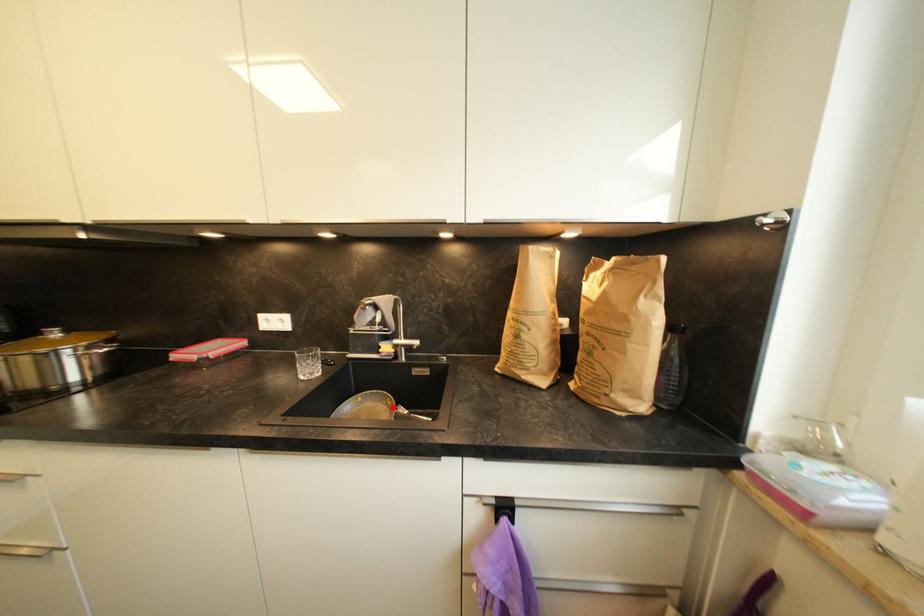
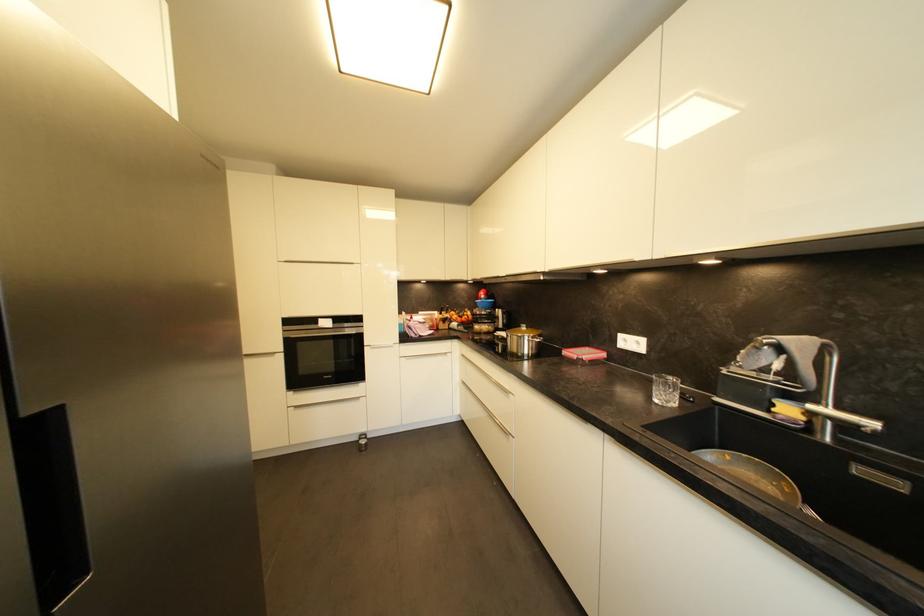
Find the pixel in the second image that matches the highlighted location in the first image.

(787, 493)